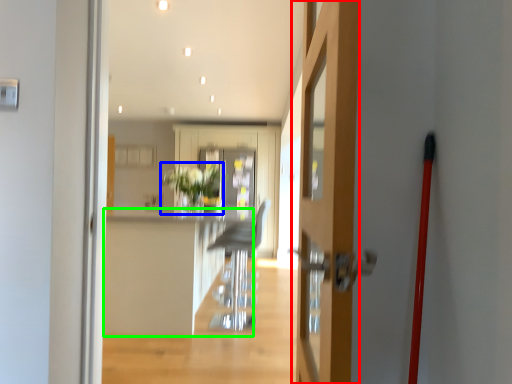
Question: Which object is the farthest from door (highlighted by a red box)? Choose among these: plant (highlighted by a blue box) or counter top (highlighted by a green box).

Choices:
 (A) plant
 (B) counter top

Answer: (A)